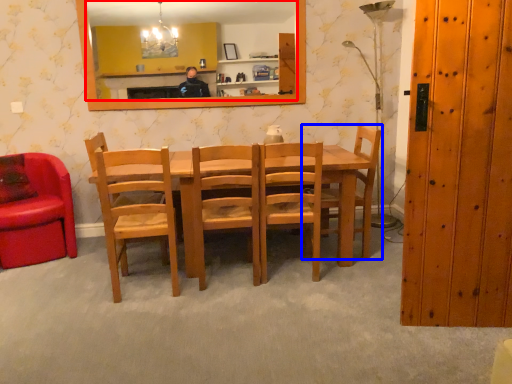
Question: Which of the following is the farthest to the observer, mirror (highlighted by a red box) or chair (highlighted by a blue box)?

Choices:
 (A) mirror
 (B) chair

Answer: (A)